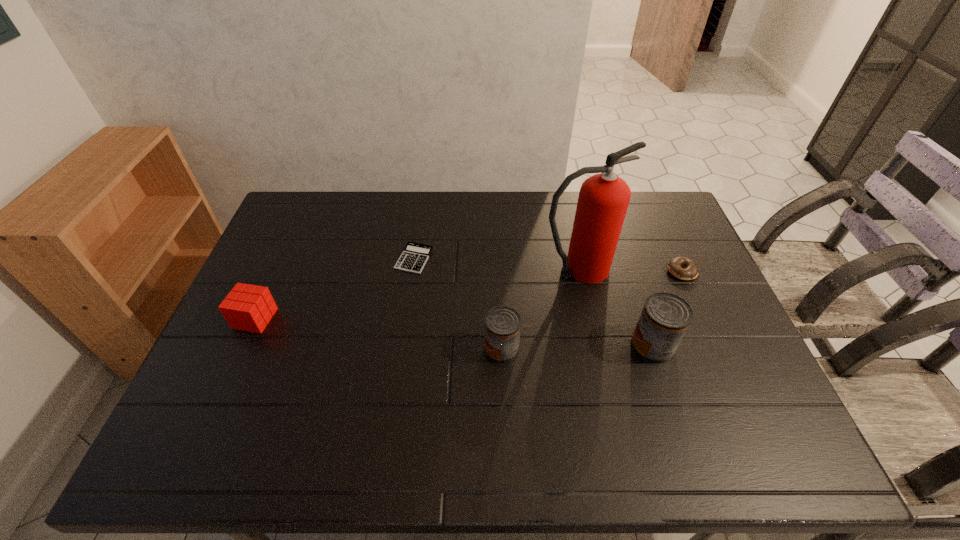
In the image, there is a desktop. Identify the location of blank space at the near edge. The width and height of the screenshot is (960, 540). (657, 386).

The width and height of the screenshot is (960, 540). Find the location of `vacant region at the right edge of the desktop`. vacant region at the right edge of the desktop is located at coordinates (731, 352).

Where is `vacant region at the far right corner of the desktop`? The height and width of the screenshot is (540, 960). vacant region at the far right corner of the desktop is located at coordinates (645, 207).

You are a GUI agent. You are given a task and a screenshot of the screen. Output one action in this format:
    pyautogui.click(x=<x>, y=<y>)
    Task: Click on the free spot between the cube and the shortest object
    
    Given the screenshot: What is the action you would take?
    pyautogui.click(x=335, y=289)

Locate an element on the screen. The width and height of the screenshot is (960, 540). free space between the cube and the right can is located at coordinates (454, 332).

At what (x,y) coordinates should I click in order to perform the action: click on free spot between the rightmost object and the shortest object. Please return your answer as a coordinate pair (x, y). This screenshot has width=960, height=540. Looking at the image, I should click on (548, 265).

You are a GUI agent. You are given a task and a screenshot of the screen. Output one action in this format:
    pyautogui.click(x=<x>, y=<y>)
    Task: Click on the free space between the taller can and the third tallest object
    The width and height of the screenshot is (960, 540).
    Given the screenshot: What is the action you would take?
    pyautogui.click(x=577, y=347)

I want to click on blank region between the doughnut and the fourth shortest object, so click(591, 310).

Find the location of a particular element. vacant point located between the third object from left to right and the tallest object is located at coordinates (539, 309).

This screenshot has height=540, width=960. I want to click on vacant space in between the tallest object and the shortest object, so click(x=495, y=264).